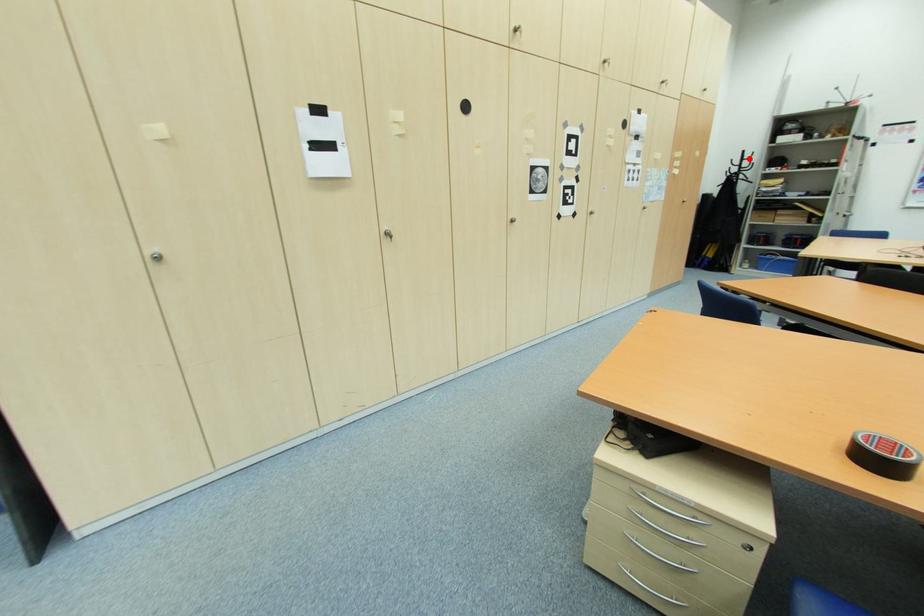
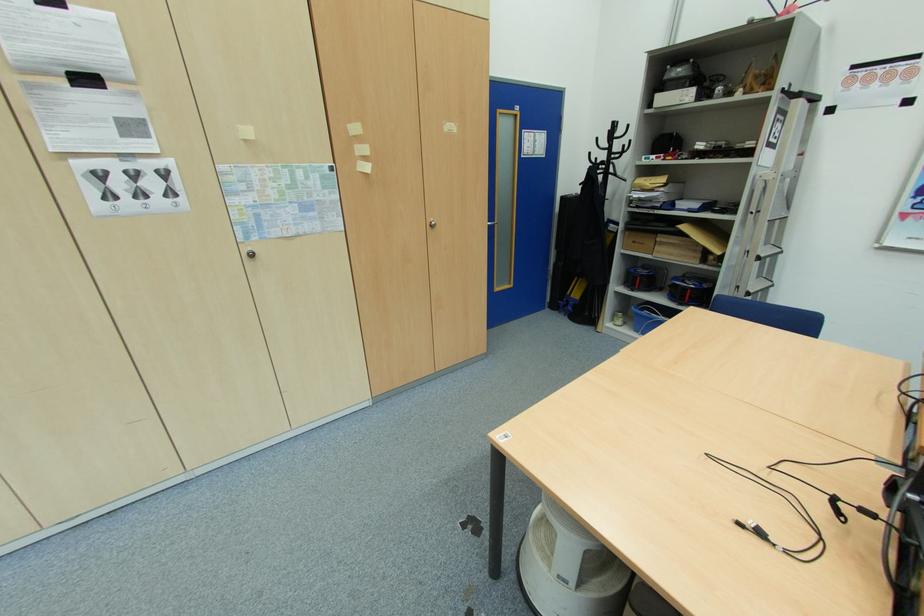
Question: I am providing you with two images of the same scene from different viewpoints. Image1 has a red point marked. In image2, the corresponding 3D location appears at what relative position? Reply with the corresponding letter.

Choices:
 (A) Closer
 (B) Farther

Answer: (A)